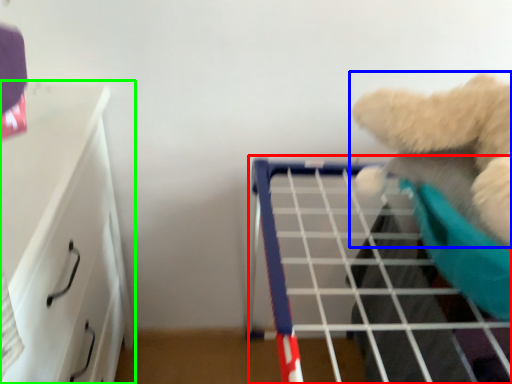
Question: Considering the real-world distances, which object is closest to shelf (highlighted by a red box)? teddy bear (highlighted by a blue box) or furniture (highlighted by a green box).

Choices:
 (A) teddy bear
 (B) furniture

Answer: (A)